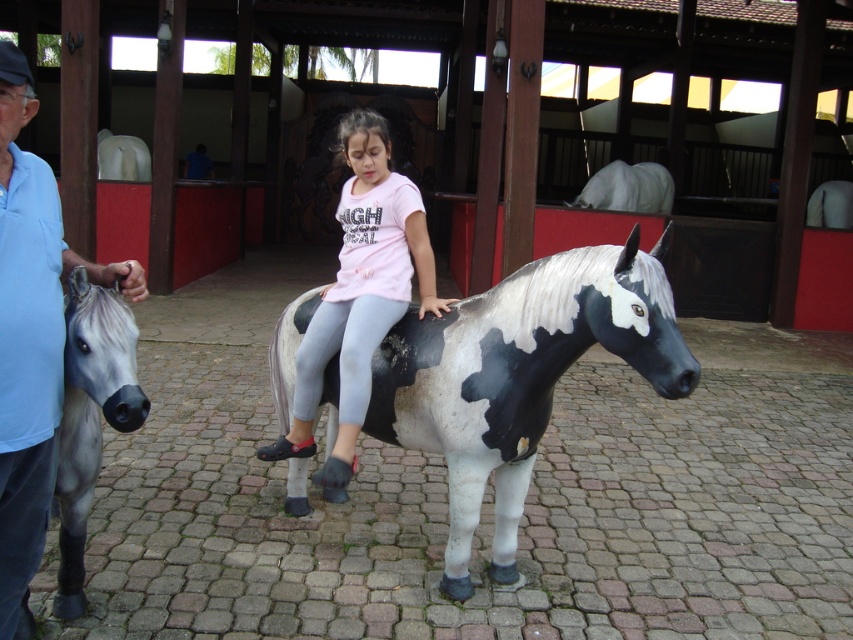
You are a visitor at the stable and want to take a photo of the painted wood horse at center and the smooth gray horse at left. Which horse should you stand closer to if you want both to be in the same frame without zooming in?

You should stand closer to the painted wood horse at center because it is shorter than the smooth gray horse at left, so positioning yourself nearer to the smaller horse will help balance their sizes in the photo frame.